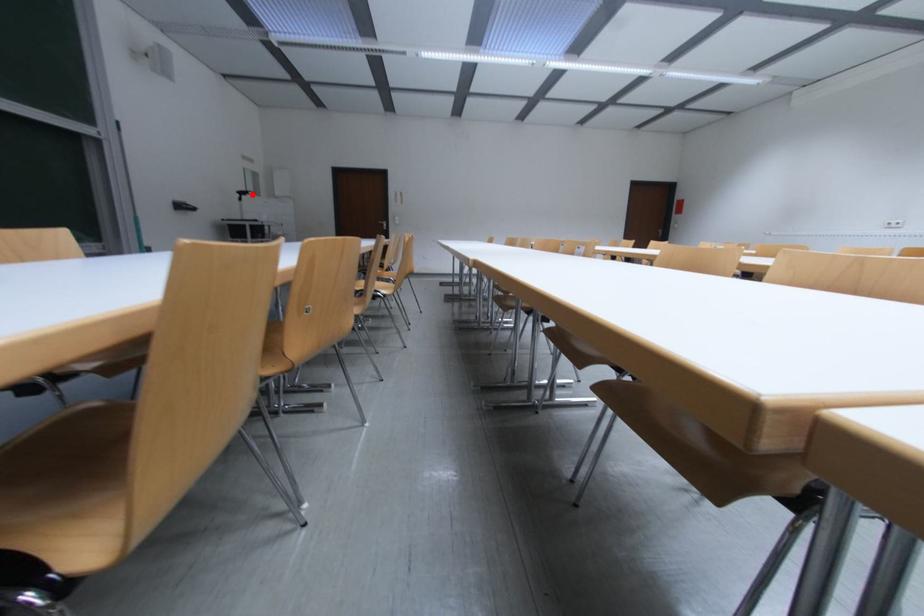
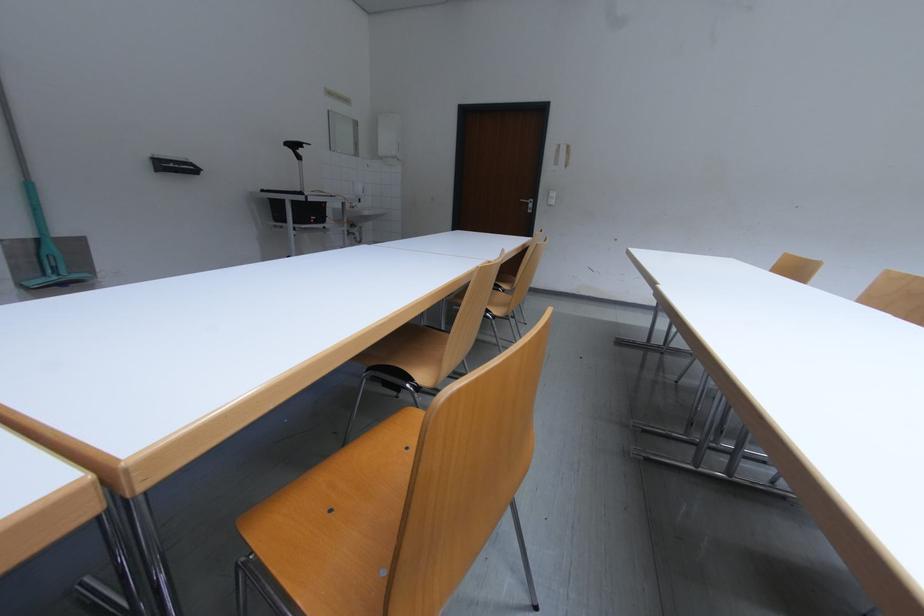
Locate, in the second image, the point that corresponds to the highlighted location in the first image.

(302, 147)